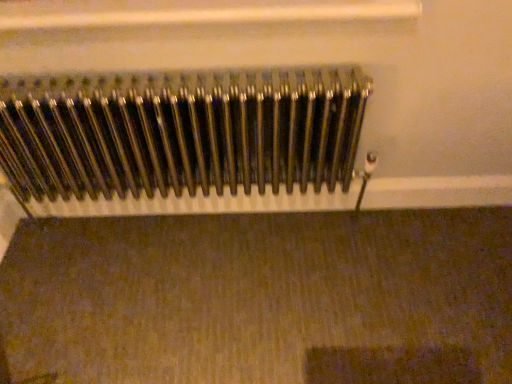
Image resolution: width=512 pixels, height=384 pixels. In order to click on vacant region below metallic radiator at center (from a real-world perspective) in this screenshot , I will do `click(183, 221)`.